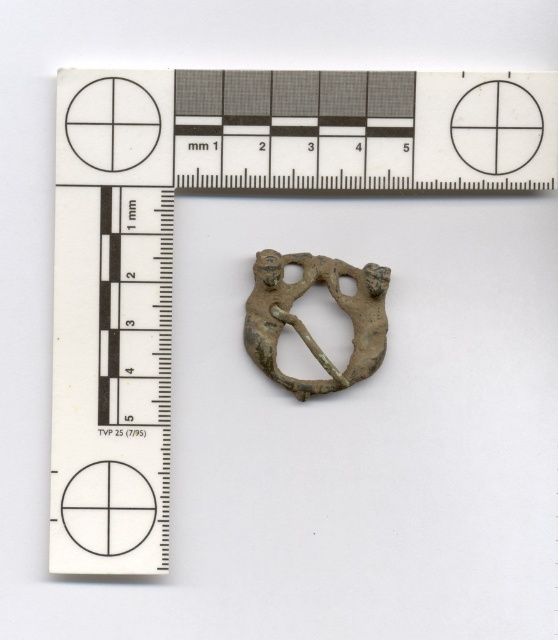
Question: Which of the following is the closest to the observer?

Choices:
 (A) matte white circle at upper left
 (B) metallic ruler at upper center
 (C) matte white circle at center
 (D) matte black circle at lower left

Answer: (B)

Question: Is matte white circle at upper left behind matte white circle at center?

Choices:
 (A) yes
 (B) no

Answer: (B)

Question: Which point is closer to the camera?

Choices:
 (A) matte white circle at upper left
 (B) metallic ruler at upper center
 (C) matte white circle at center

Answer: (B)

Question: Can you confirm if metallic ruler at upper center is wider than matte black circle at lower left?

Choices:
 (A) no
 (B) yes

Answer: (B)

Question: Is matte white circle at upper left above matte white circle at center?

Choices:
 (A) yes
 (B) no

Answer: (A)

Question: Which point appears closest to the camera in this image?

Choices:
 (A) (474, 120)
 (B) (104, 545)

Answer: (B)